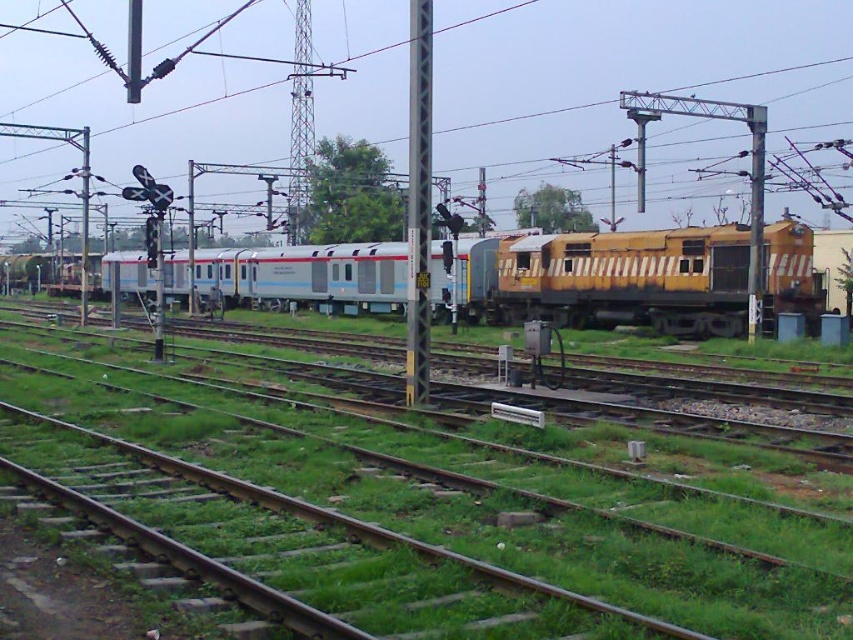
You are a railway worker who needs to place a 6 meter long safety barrier between the green grass at center and the metallic gray pole at center. Can you fit the barrier between them without overlapping either object?

The distance between the green grass at center and the metallic gray pole at center is 6.16 meters. Since the safety barrier is 6 meters long, it can be placed between them without overlapping either object as there is sufficient space.

You are a railway worker inspecting the tracks. You notice the green grass at center and the metallic gray pole at center. Which object is closer to the left side of the tracks?

The green grass at center is closer to the left side of the tracks because it is positioned to the left of the metallic gray pole at center.